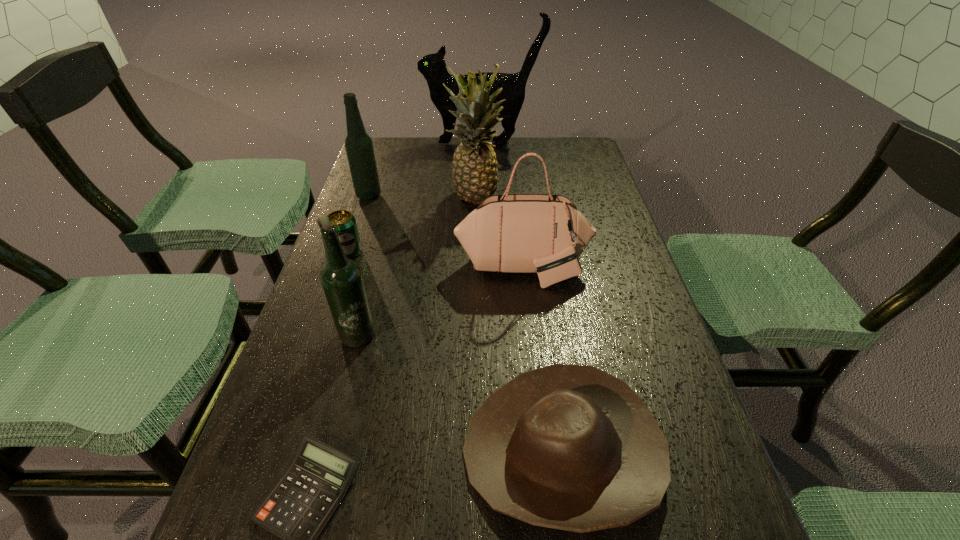
You are a GUI agent. You are given a task and a screenshot of the screen. Output one action in this format:
    pyautogui.click(x=<x>, y=<y>)
    Task: Click on the free space at the left edge of the desktop
    
    Given the screenshot: What is the action you would take?
    pyautogui.click(x=317, y=298)

This screenshot has width=960, height=540. In the image, there is a desktop. What are the coordinates of `vacant space at the right edge` in the screenshot? It's located at (591, 277).

I want to click on free region at the far right corner of the desktop, so click(x=571, y=137).

This screenshot has width=960, height=540. Find the location of `blank region between the pineapple and the alcohol`. blank region between the pineapple and the alcohol is located at coordinates (422, 197).

Find the location of a particular element. unoccupied position between the cat and the alcohol is located at coordinates (425, 170).

The height and width of the screenshot is (540, 960). In order to click on unoccupied position between the pineapple and the beer can in this screenshot , I will do `click(412, 225)`.

Find the location of a particular element. The image size is (960, 540). free space between the farthest object and the beer bottle is located at coordinates (420, 238).

At what (x,y) coordinates should I click in order to perform the action: click on blank region between the beer bottle and the handbag. Please return your answer as a coordinate pair (x, y). Looking at the image, I should click on (441, 300).

The image size is (960, 540). I want to click on blank region between the cat and the beer can, so click(x=415, y=198).

Where is `object that is the seventh nearest to the shortest object`? This screenshot has width=960, height=540. object that is the seventh nearest to the shortest object is located at coordinates (433, 67).